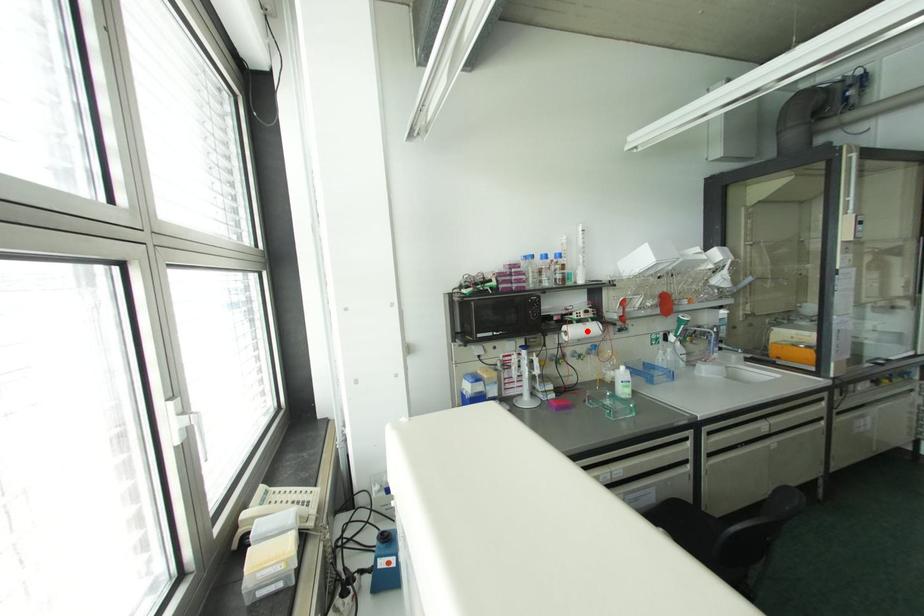
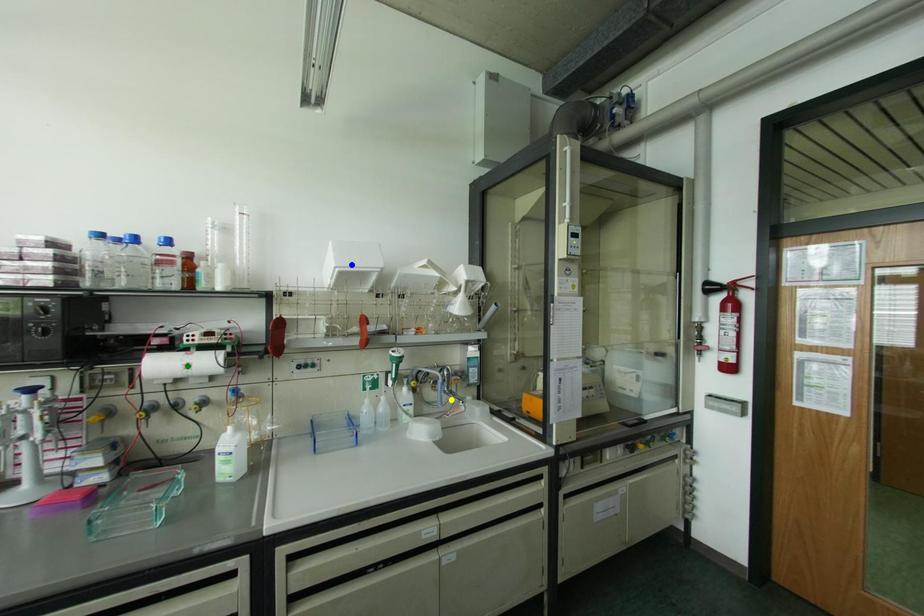
Question: I am providing you with two images of the same scene from different viewpoints. A red point is marked on the first image. You are given multiple points on the second image. Which point in image 2 represents the same 3d spot as the red point in image 1?

Choices:
 (A) blue point
 (B) yellow point
 (C) green point

Answer: (C)